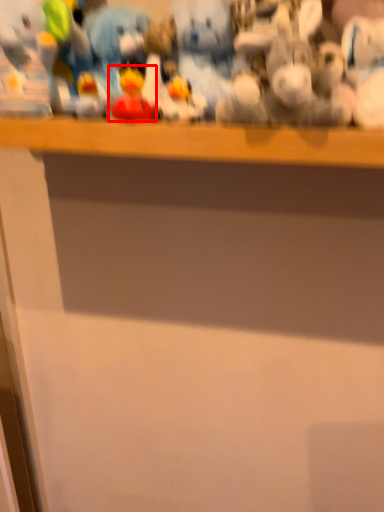
Question: From the image's perspective, what is the correct spatial relationship of toy (annotated by the red box) in relation to toy?

Choices:
 (A) above
 (B) below

Answer: (B)